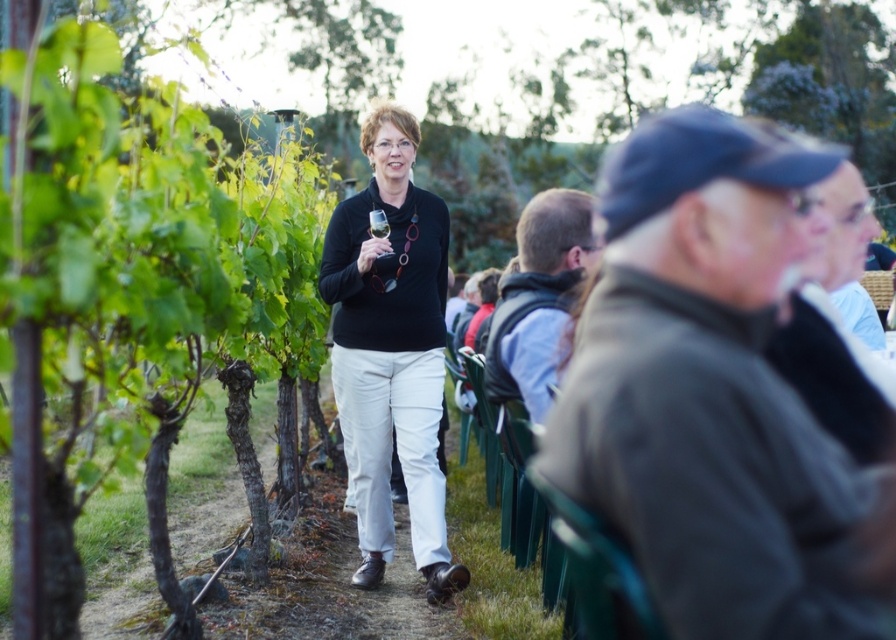
You are a photographer at the vineyard and want to capture both the dark brown leather jacket at right and the light blue shirt at right in a single frame. Which object should you position closer to the left side of your camera viewfinder to ensure both are visible?

To include both the dark brown leather jacket at right and the light blue shirt at right in the frame, position the dark brown leather jacket at right closer to the left side of the camera viewfinder since it is already to the left of the light blue shirt at right.

You are a photographer positioned at the center of the vineyard path. You need to take a photo that includes both the matte black sweater at center and the light brown leather jacket at center. What is the minimum distance you need to move backward to ensure both objects are fully visible in your frame?

The matte black sweater at center is 1.79 meters away from the light brown leather jacket at center. To include both in the frame, you need to move back at least 1.79 meters so that the distance between them fits within your camera view.

You are a photographer trying to capture a candid shot of the dark brown leather jacket at right and the light blue shirt at right. Which one is lower in the image?

The dark brown leather jacket at right is positioned under the light blue shirt at right, so it is lower in the image.